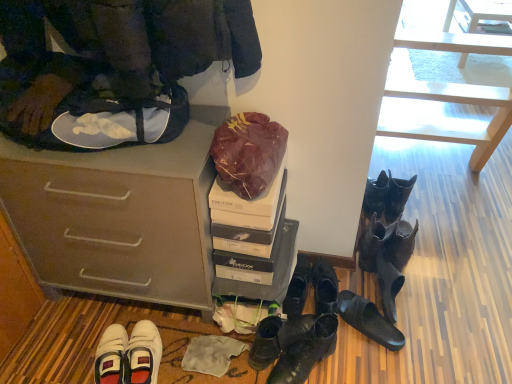
What do you see at coordinates (485, 12) in the screenshot?
I see `white glossy table at upper right` at bounding box center [485, 12].

At what (x,y) coordinates should I click in order to perform the action: click on burgundy fabric bag at upper center. Please return your answer as a coordinate pair (x, y). Looking at the image, I should click on (248, 153).

Image resolution: width=512 pixels, height=384 pixels. Describe the element at coordinates (297, 288) in the screenshot. I see `black leather shoes at center, placed as the third footwear when sorted from left to right` at that location.

What is the approximate width of white cardboard shoebox at center?

white cardboard shoebox at center is 14.42 inches in width.

You are a GUI agent. You are given a task and a screenshot of the screen. Output one action in this format:
    pyautogui.click(x=<x>, y=<y>)
    Task: Click on the black rubber sandals at lower center, the fourth footwear from the right
    This screenshot has height=384, width=512.
    Given the screenshot: What is the action you would take?
    pyautogui.click(x=368, y=320)

Looking at this image, from the image's perspective, which is below, black leather shoes at center, placed as the third footwear when sorted from left to right, or black leather boots at lower right, acting as the 2th footwear starting from the right?

black leather shoes at center, placed as the third footwear when sorted from left to right, appears lower in the image.

Is black leather shoes at center, placed as the third footwear when sorted from left to right, placed right next to black leather boots at lower right, acting as the 2th footwear starting from the right?

black leather shoes at center, placed as the third footwear when sorted from left to right, and black leather boots at lower right, acting as the 2th footwear starting from the right, are not in contact.

Which of these two, black leather shoes at center, placed as the third footwear when sorted from left to right, or black leather boots at lower right, the seventh footwear from the left, is bigger?

Bigger between the two is black leather boots at lower right, the seventh footwear from the left.

Can you confirm if black leather shoes at center, placed as the third footwear when sorted from left to right, is shorter than black leather boots at lower right, acting as the 2th footwear starting from the right?

Correct, black leather shoes at center, placed as the third footwear when sorted from left to right, is not as tall as black leather boots at lower right, acting as the 2th footwear starting from the right.

What's the angular difference between black rubber sandals at lower center, the fourth footwear from the right, and burgundy fabric bag at upper center's facing directions?

The angle between the facing direction of black rubber sandals at lower center, the fourth footwear from the right, and the facing direction of burgundy fabric bag at upper center is 57.3 degrees.

Does black rubber sandals at lower center, arranged as the 5th footwear when viewed from the left, touch burgundy fabric bag at upper center?

No, black rubber sandals at lower center, arranged as the 5th footwear when viewed from the left, is not touching burgundy fabric bag at upper center.

Looking at the image, does black rubber sandals at lower center, the fourth footwear from the right, seem bigger or smaller compared to burgundy fabric bag at upper center?

Considering their sizes, black rubber sandals at lower center, the fourth footwear from the right, takes up less space than burgundy fabric bag at upper center.

This screenshot has width=512, height=384. There is a black rubber sandals at lower center, the fourth footwear from the right. In order to click on bag above it (from a real-world perspective) in this screenshot , I will do `click(248, 153)`.

What's the angular difference between white cardboard shoebox at center and leather boots at center, acting as the eighth footwear starting from the right,'s facing directions?

121 degrees separate the facing orientations of white cardboard shoebox at center and leather boots at center, acting as the eighth footwear starting from the right.

From a real-world perspective, count 5th footwears downward from the white cardboard shoebox at center and point to it. Please provide its 2D coordinates.

[(277, 338)]

Is white cardboard shoebox at center oriented away from leather boots at center, acting as the eighth footwear starting from the right?

No, white cardboard shoebox at center's orientation is not away from leather boots at center, acting as the eighth footwear starting from the right.

Is black leather boots at lower right, the 6th footwear from the left, inside or outside of black leather boots at right, arranged as the eighth footwear when viewed from the left?

The correct answer is: outside.

From the image's perspective, is black leather boots at lower right, the 6th footwear from the left, located above or below black leather boots at right, the first footwear in the right-to-left sequence?

Based on their image positions, black leather boots at lower right, the 6th footwear from the left, is located beneath black leather boots at right, the first footwear in the right-to-left sequence.

Based on the photo, is black leather boots at lower right, arranged as the 3th footwear when viewed from the right, smaller than black leather boots at right, the first footwear in the right-to-left sequence?

Correct, black leather boots at lower right, arranged as the 3th footwear when viewed from the right, occupies less space than black leather boots at right, the first footwear in the right-to-left sequence.

Is black leather boots at lower right, the 6th footwear from the left, positioned behind black leather boots at right, the first footwear in the right-to-left sequence?

No, black leather boots at lower right, the 6th footwear from the left, is closer to the viewer.

Looking at this image, what's the angular difference between white cardboard shoebox at center and burgundy fabric bag at upper center's facing directions?

0.462 degrees.

Locate an element on the screen. Image resolution: width=512 pixels, height=384 pixels. book that is below the burgundy fabric bag at upper center (from the image's perspective) is located at coordinates (249, 247).

Is white cardboard shoebox at center looking in the opposite direction of burgundy fabric bag at upper center?

No, white cardboard shoebox at center's orientation is not away from burgundy fabric bag at upper center.

Can you confirm if white cardboard shoebox at center is smaller than burgundy fabric bag at upper center?

Indeed, white cardboard shoebox at center has a smaller size compared to burgundy fabric bag at upper center.

In terms of size, does black leather boots at lower right, the seventh footwear from the left, appear bigger or smaller than black leather boots at right, arranged as the eighth footwear when viewed from the left?

In the image, black leather boots at lower right, the seventh footwear from the left, appears to be smaller than black leather boots at right, arranged as the eighth footwear when viewed from the left.

You are a GUI agent. You are given a task and a screenshot of the screen. Output one action in this format:
    pyautogui.click(x=<x>, y=<y>)
    Task: Click on the 1st footwear to the left of the black leather boots at right, arranged as the eighth footwear when viewed from the left, starting your count from the anchor
    The width and height of the screenshot is (512, 384).
    Given the screenshot: What is the action you would take?
    pyautogui.click(x=387, y=243)

Is point (374, 224) farther from viewer compared to point (376, 190)?

That is False.

Which object is closer to the camera taking this photo, black leather boots at lower right, acting as the 2th footwear starting from the right, or black leather boots at right, the first footwear in the right-to-left sequence?

Positioned in front is black leather boots at lower right, acting as the 2th footwear starting from the right.

Considering the sizes of black leather shoes at lower center, marked as the fifth footwear in a right-to-left arrangement, and black leather boots at lower right, the seventh footwear from the left, in the image, is black leather shoes at lower center, marked as the fifth footwear in a right-to-left arrangement, wider or thinner than black leather boots at lower right, the seventh footwear from the left,?

black leather shoes at lower center, marked as the fifth footwear in a right-to-left arrangement, is wider than black leather boots at lower right, the seventh footwear from the left.

Can you confirm if black leather shoes at lower center, the fourth footwear when ordered from left to right, is positioned to the left of black leather boots at lower right, the seventh footwear from the left?

Yes, black leather shoes at lower center, the fourth footwear when ordered from left to right, is to the left of black leather boots at lower right, the seventh footwear from the left.

Considering the sizes of black leather shoes at lower center, the fourth footwear when ordered from left to right, and black leather boots at lower right, the seventh footwear from the left, in the image, is black leather shoes at lower center, the fourth footwear when ordered from left to right, bigger or smaller than black leather boots at lower right, the seventh footwear from the left,?

Considering their sizes, black leather shoes at lower center, the fourth footwear when ordered from left to right, takes up less space than black leather boots at lower right, the seventh footwear from the left.

How distant is black leather shoes at lower center, marked as the fifth footwear in a right-to-left arrangement, from black leather boots at lower right, acting as the 2th footwear starting from the right?

10.00 inches.

You are a GUI agent. You are given a task and a screenshot of the screen. Output one action in this format:
    pyautogui.click(x=<x>, y=<y>)
    Task: Click on the 4th footwear counting from the right of the black leather shoes at center, placed as the third footwear when sorted from left to right
    
    Given the screenshot: What is the action you would take?
    pyautogui.click(x=387, y=243)

Where is `the 3rd footwear positioned below the burgundy fabric bag at upper center (from a real-world perspective)`? the 3rd footwear positioned below the burgundy fabric bag at upper center (from a real-world perspective) is located at coordinates (368, 320).

Based on the photo, which object lies further to the anchor point black leather boots at lower right, the 6th footwear from the left, black leather shoes at center, placed as the third footwear when sorted from left to right, or black leather shoes at lower center, the fourth footwear when ordered from left to right?

black leather shoes at center, placed as the third footwear when sorted from left to right, is further to black leather boots at lower right, the 6th footwear from the left.

Which object lies nearer to the anchor point black leather boots at lower right, the seventh footwear from the left, white cardboard shoebox at center or matte brown cabinet at upper left?

white cardboard shoebox at center.

Looking at the image, which one is located further to white cardboard shoebox at center, black leather boots at right, arranged as the eighth footwear when viewed from the left, or black leather boots at lower right, arranged as the 3th footwear when viewed from the right?

black leather boots at right, arranged as the eighth footwear when viewed from the left, is further to white cardboard shoebox at center.

Estimate the real-world distances between objects in this image. Which object is closer to shiny black boots at center, the 7th footwear viewed from the right, black leather boots at right, arranged as the eighth footwear when viewed from the left, or black leather shoes at center, the sixth footwear viewed from the right?

black leather shoes at center, the sixth footwear viewed from the right, is positioned closer to the anchor shiny black boots at center, the 7th footwear viewed from the right.

Which object lies further to the anchor point black leather boots at lower right, the seventh footwear from the left, white glossy table at upper right or black leather shoes at lower center, the fourth footwear when ordered from left to right?

white glossy table at upper right is positioned further to the anchor black leather boots at lower right, the seventh footwear from the left.

From the image, which object appears to be farther from white glossy table at upper right, black leather boots at lower right, arranged as the 3th footwear when viewed from the right, or burgundy fabric bag at upper center?

The object further to white glossy table at upper right is burgundy fabric bag at upper center.

Estimate the real-world distances between objects in this image. Which object is closer to matte brown cabinet at upper left, black leather boots at right, the first footwear in the right-to-left sequence, or leather boots at center, acting as the eighth footwear starting from the right?

leather boots at center, acting as the eighth footwear starting from the right, is closer to matte brown cabinet at upper left.

Based on their spatial positions, is black leather shoes at center, placed as the third footwear when sorted from left to right, or white cardboard shoebox at center further from black rubber sandals at lower center, arranged as the 5th footwear when viewed from the left?

white cardboard shoebox at center.

Find the location of `bag situated between matte brown cabinet at upper left and black leather boots at right, arranged as the eighth footwear when viewed from the left, from left to right`. bag situated between matte brown cabinet at upper left and black leather boots at right, arranged as the eighth footwear when viewed from the left, from left to right is located at coordinates (248, 153).

The height and width of the screenshot is (384, 512). Identify the location of cabinetry between burgundy fabric bag at upper center and leather boots at center, acting as the eighth footwear starting from the right, in the vertical direction. (118, 216).

The image size is (512, 384). Find the location of `book between burgundy fabric bag at upper center and leather boots at center, the 1th footwear positioned from the left, in the vertical direction`. book between burgundy fabric bag at upper center and leather boots at center, the 1th footwear positioned from the left, in the vertical direction is located at coordinates (249, 247).

Identify the location of book located between matte brown cabinet at upper left and black leather boots at lower right, acting as the 2th footwear starting from the right, in the left-right direction. The image size is (512, 384). (249, 247).